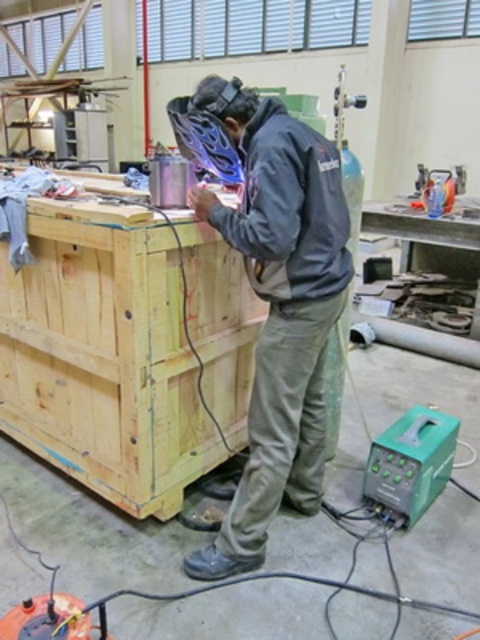
You are a delivery person who just arrived at the workshop. You need to place a new welding machine exactly where the old one is located. The old welding machine is at point (x=124, y=349). However, there is an object at that location. What is the object blocking the placement of the new welding machine?

The point (x=124, y=349) marks the yellow wood crate at center, so placing the new welding machine there would block the yellow wood crate at center.

You are a safety inspector in the workshop. You need to ensure that the welding equipment is properly positioned. According to the image, is the yellow wood crate at center located below the dark gray jacket at center?

Yes, the yellow wood crate at center is below the dark gray jacket at center, so the welding equipment is positioned correctly.

You are standing in the workshop and need to move the welding machine to the yellow wood crate at center. Which direction should you move the welding machine to reach the crate?

The yellow wood crate at center is located at coordinates point (124,349), so you should move the welding machine towards the center of the workshop to reach it.